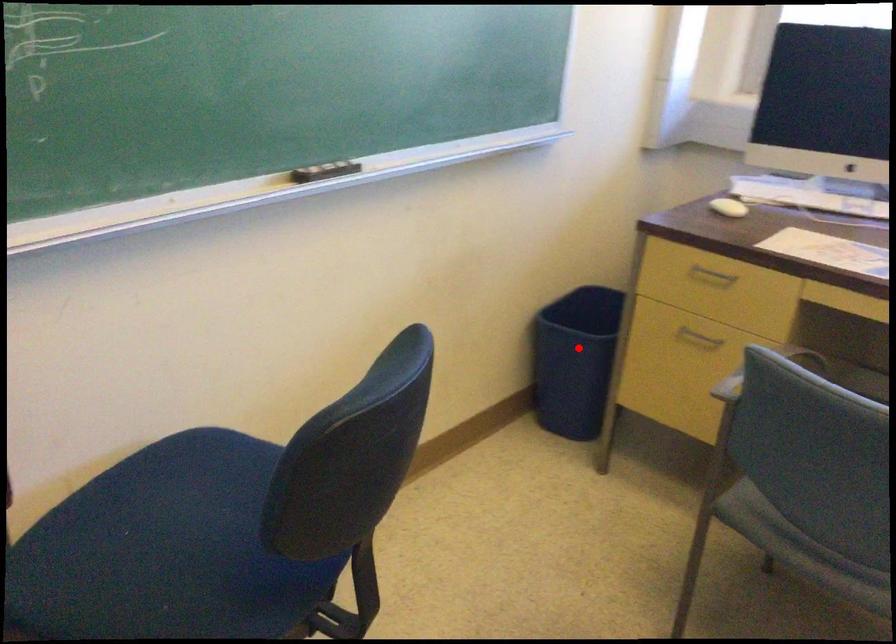
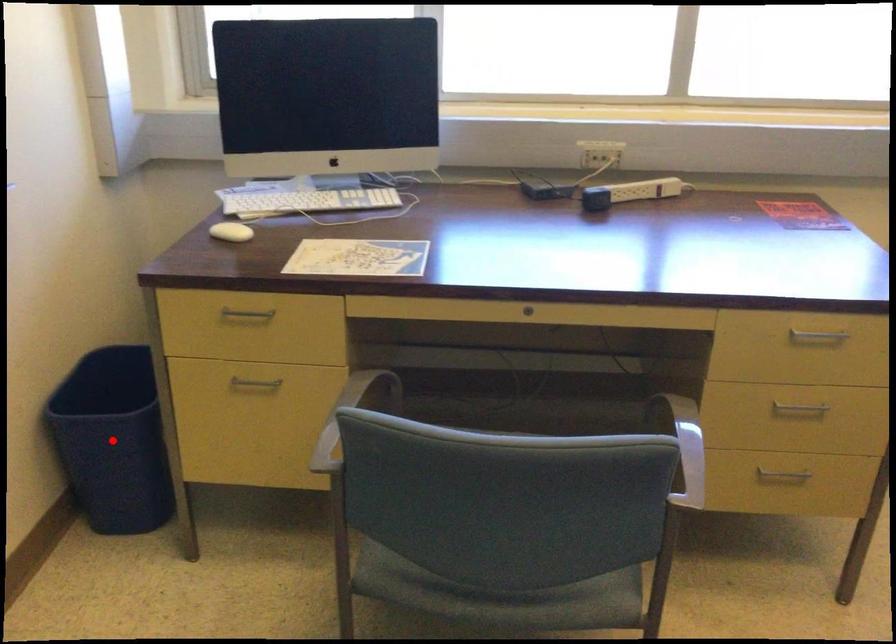
I am providing you with two images of the same scene from different viewpoints. A red point is marked on the first image and another point is marked on the second image. Do the highlighted points in image1 and image2 indicate the same real-world spot?

Yes